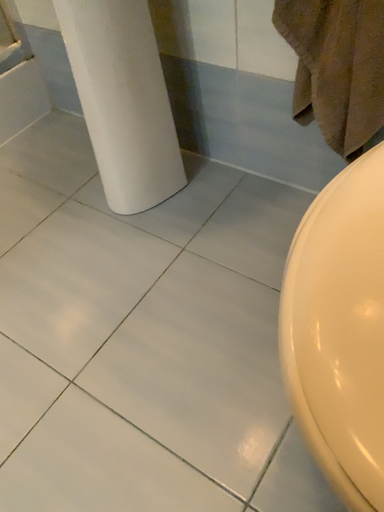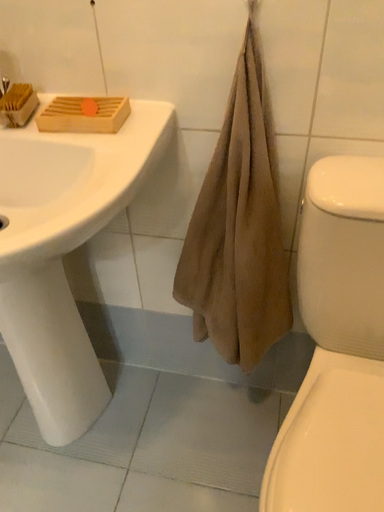
Question: Which way did the camera rotate in the video?

Choices:
 (A) rotated right
 (B) rotated left

Answer: (A)